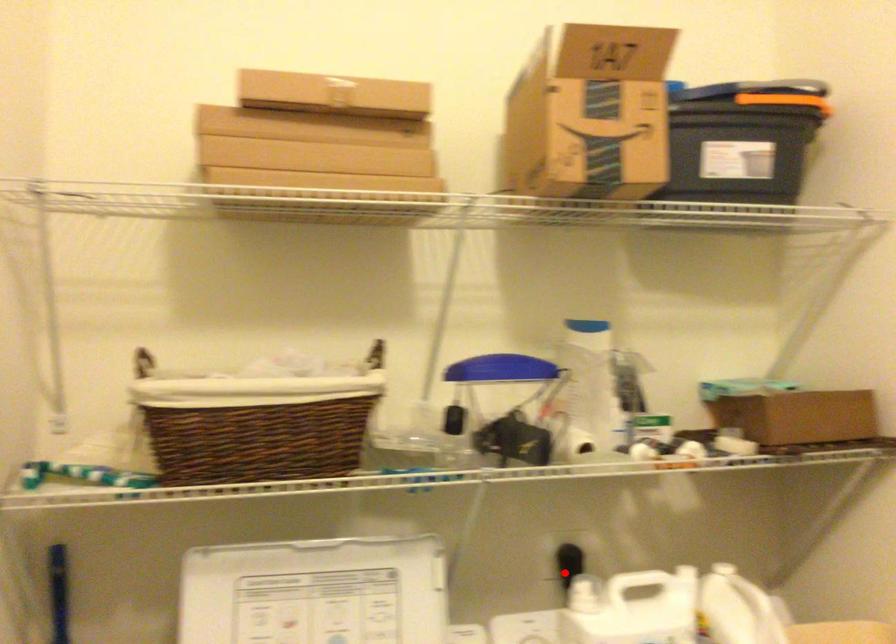
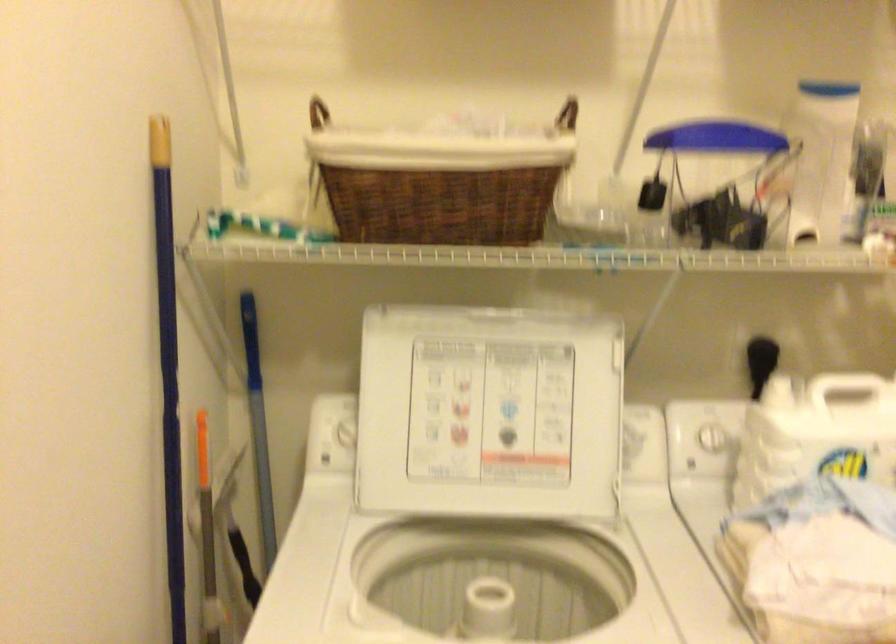
Question: I am providing you with two images of the same scene from different viewpoints. In image1, a red point is highlighted. Considering the same 3D point in image2, which of the following is correct?

Choices:
 (A) It is closer
 (B) It is farther

Answer: (A)